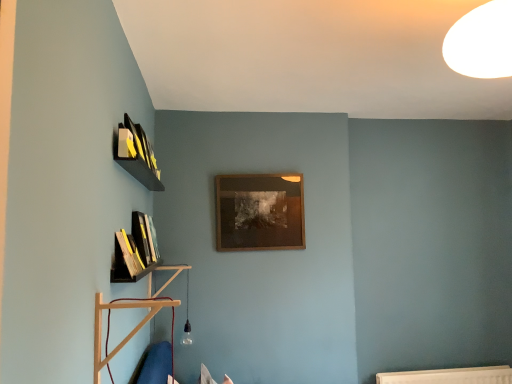
Question: Is hardcover book at left, arranged as the 2th book when viewed from the front, not close to wooden book at lower left, which is counted as the 1th book, starting from the front?

Choices:
 (A) yes
 (B) no

Answer: (B)

Question: Can we say hardcover book at left, arranged as the 2th book when viewed from the front, lies outside wooden book at lower left, which is counted as the 1th book, starting from the front?

Choices:
 (A) yes
 (B) no

Answer: (A)

Question: Can you confirm if hardcover book at left, marked as the first book in a back-to-front arrangement, is smaller than wooden book at lower left, which is counted as the 1th book, starting from the front?

Choices:
 (A) yes
 (B) no

Answer: (B)

Question: Does hardcover book at left, marked as the first book in a back-to-front arrangement, have a greater width compared to wooden book at lower left, which is counted as the 1th book, starting from the front?

Choices:
 (A) yes
 (B) no

Answer: (B)

Question: Does hardcover book at left, arranged as the 2th book when viewed from the front, have a greater height compared to wooden book at lower left, which is the 2th book from back to front?

Choices:
 (A) yes
 (B) no

Answer: (A)

Question: Is black matte shelf at left, placed as the 2th shelf when sorted from front to back, bigger or smaller than wooden picture frame at center?

Choices:
 (A) big
 (B) small

Answer: (A)

Question: From their relative heights in the image, would you say black matte shelf at left, placed as the 2th shelf when sorted from front to back, is taller or shorter than wooden picture frame at center?

Choices:
 (A) short
 (B) tall

Answer: (A)

Question: Is black matte shelf at left, the 1th shelf in the back-to-front sequence, situated inside wooden picture frame at center or outside?

Choices:
 (A) outside
 (B) inside

Answer: (A)

Question: From the image's perspective, is black matte shelf at left, placed as the 2th shelf when sorted from front to back, positioned above or below wooden picture frame at center?

Choices:
 (A) above
 (B) below

Answer: (B)

Question: Is point (131, 256) closer or farther from the camera than point (152, 261)?

Choices:
 (A) closer
 (B) farther

Answer: (A)

Question: Is wooden book at lower left, which is counted as the 1th book, starting from the front, in front of or behind black matte shelf at left, placed as the 2th shelf when sorted from front to back, in the image?

Choices:
 (A) behind
 (B) front

Answer: (A)

Question: In the image, is wooden book at lower left, which is the 2th book from back to front, on the left side or the right side of black matte shelf at left, the 1th shelf in the back-to-front sequence?

Choices:
 (A) left
 (B) right

Answer: (B)

Question: From a real-world perspective, is wooden book at lower left, which is counted as the 1th book, starting from the front, positioned above or below black matte shelf at left, placed as the 2th shelf when sorted from front to back?

Choices:
 (A) below
 (B) above

Answer: (A)

Question: Considering the positions of wooden picture frame at center and hardcover book at left, arranged as the 2th book when viewed from the front, in the image, is wooden picture frame at center wider or thinner than hardcover book at left, arranged as the 2th book when viewed from the front,?

Choices:
 (A) wide
 (B) thin

Answer: (B)

Question: Is point (221, 228) positioned closer to the camera than point (156, 244)?

Choices:
 (A) farther
 (B) closer

Answer: (A)